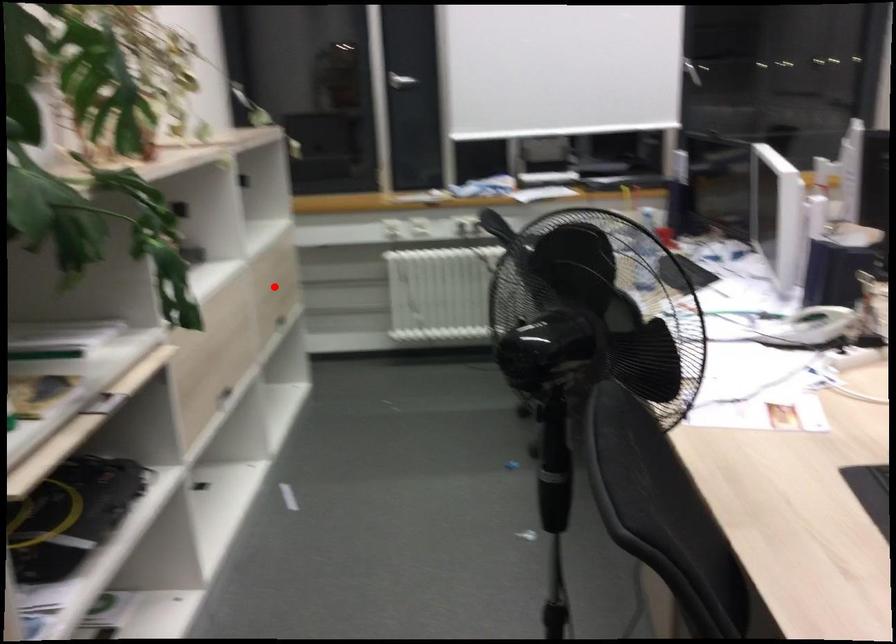
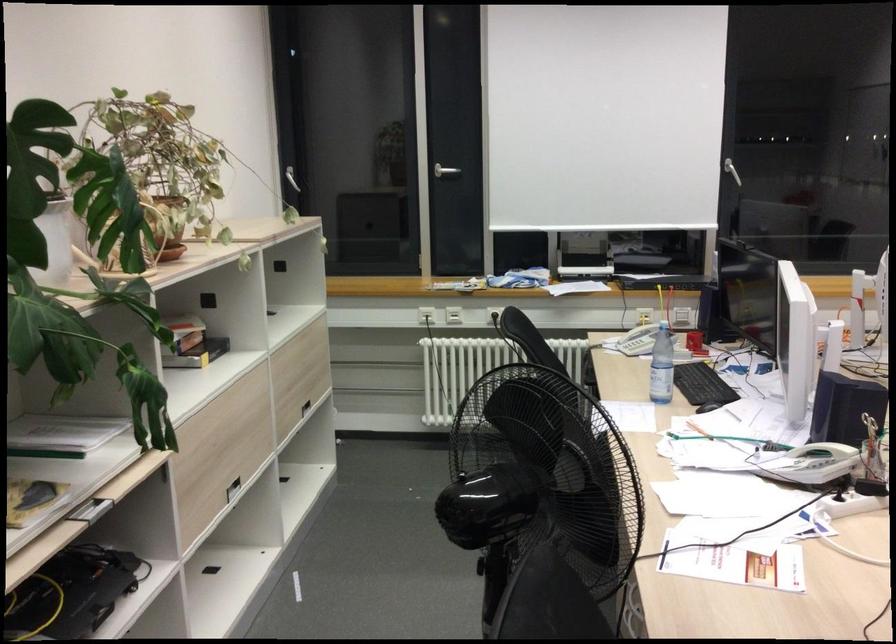
Locate, in the second image, the point that corresponds to the highlighted location in the first image.

(298, 375)